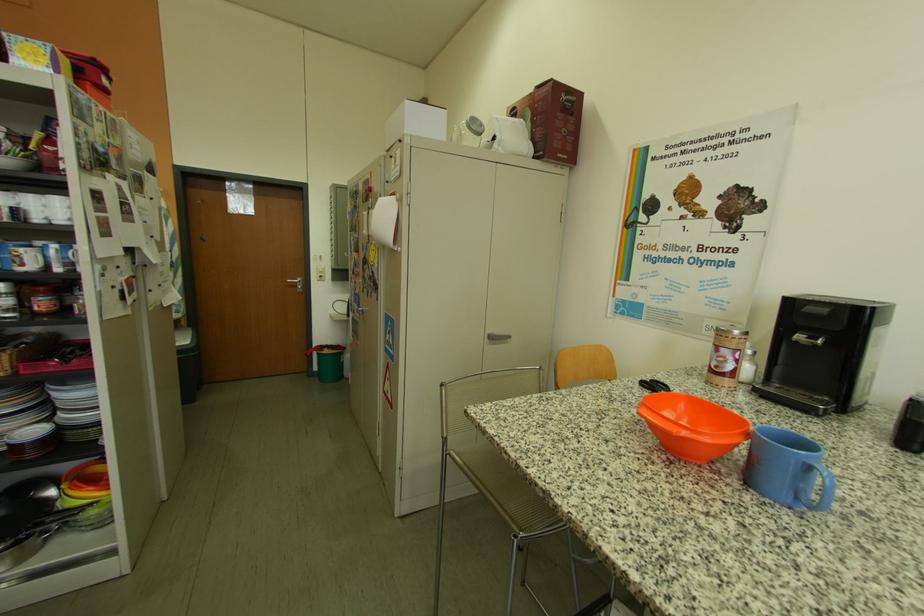
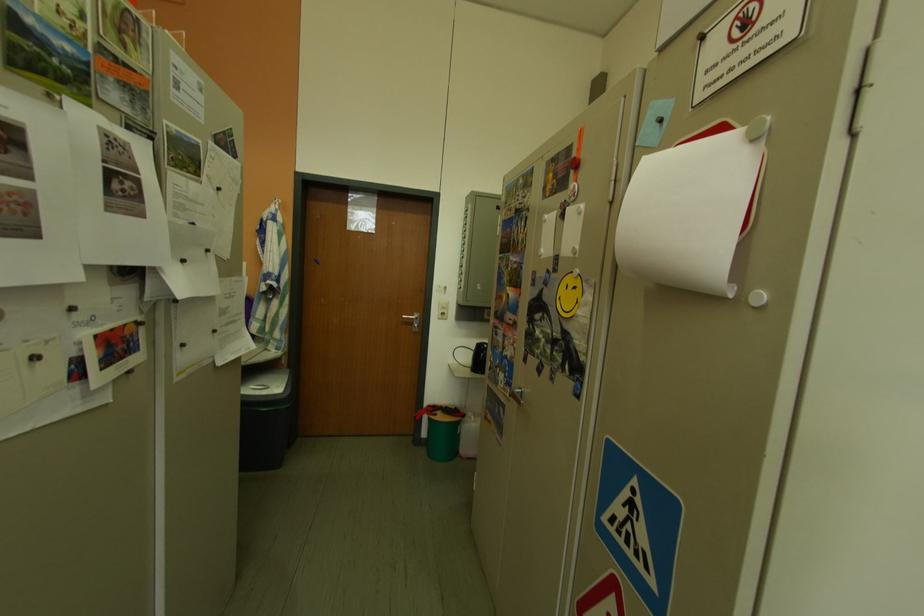
What movement of the cameraman would produce the second image?

The movement direction of the cameraman is left, forward.